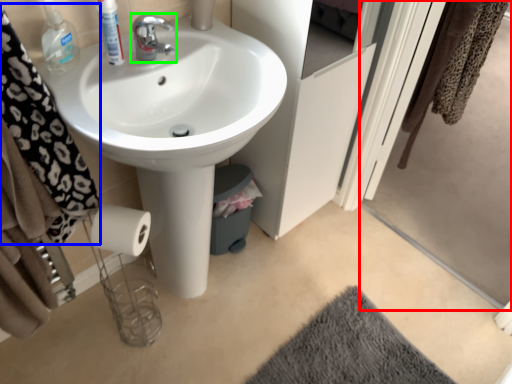
Question: Which is farther away from screen door (highlighted by a red box)? bath towel (highlighted by a blue box) or tap (highlighted by a green box)?

Choices:
 (A) bath towel
 (B) tap

Answer: (A)